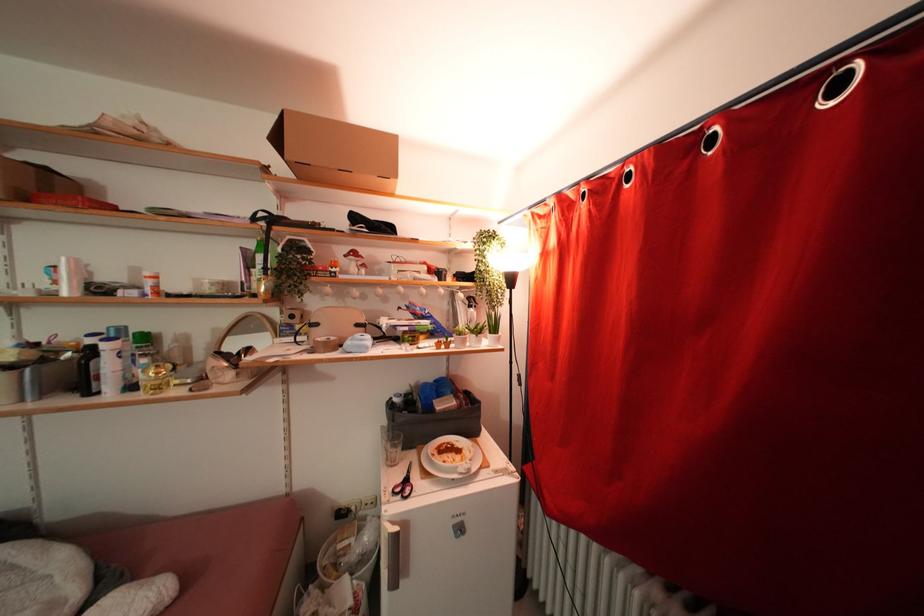
The image size is (924, 616). In order to click on drinking glass in this screenshot , I will do `click(391, 446)`.